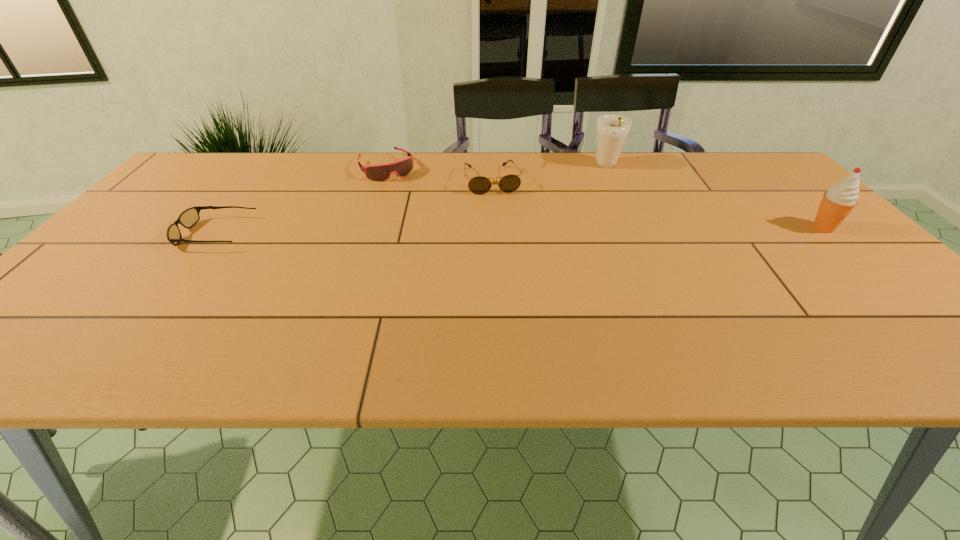
Select which object appears as the third closest to the icecream. Please provide its 2D coordinates. Your answer should be formatted as a tuple, i.e. [(x, y)], where the tuple contains the x and y coordinates of a point satisfying the conditions above.

[(381, 172)]

At what (x,y) coordinates should I click in order to perform the action: click on vacant space that satisfies the following two spatial constraints: 1. on the back side of the fourth object from left to right; 2. on the left side of the second object from left to right. Please return your answer as a coordinate pair (x, y). Looking at the image, I should click on (387, 167).

Find the location of a particular element. The image size is (960, 540). free space that satisfies the following two spatial constraints: 1. on the front side of the icecream; 2. on the left side of the second object from left to right is located at coordinates (366, 228).